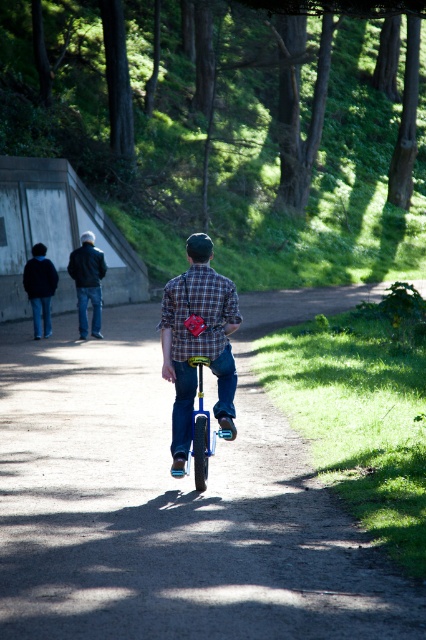
You are a photographer trying to capture a clear photo of the person riding the unicycle. However, there is a plaid shirt at center and a plaid fabric shirt at center in the scene. Which one should you focus on to ensure the subject is sharp?

The plaid shirt at center and plaid fabric shirt at center are actually the same object. The distance of 3.96 inches mentioned is likely a measurement error, so focus on the plaid shirt at center for clarity.

You are standing at the starting point of the path in the park. You see a blue metallic unicycle at center marked by point (173, 499). If you walk straight ahead along the path, will you reach the unicycle before the path curves to the right?

The point (173, 499) marks the blue metallic unicycle at center, so walking straight ahead along the path will lead you directly to the unicycle before any curves, as the path curves to the right after the unicycle location.

You are a photographer trying to capture the person riding the unicycle in the park. You notice two shirts on the person mentioned in the scene. Which one is narrower between the plaid shirt at center and the plaid fabric shirt at center?

The plaid shirt at center is thinner than the plaid fabric shirt at center, so the plaid shirt at center is narrower.